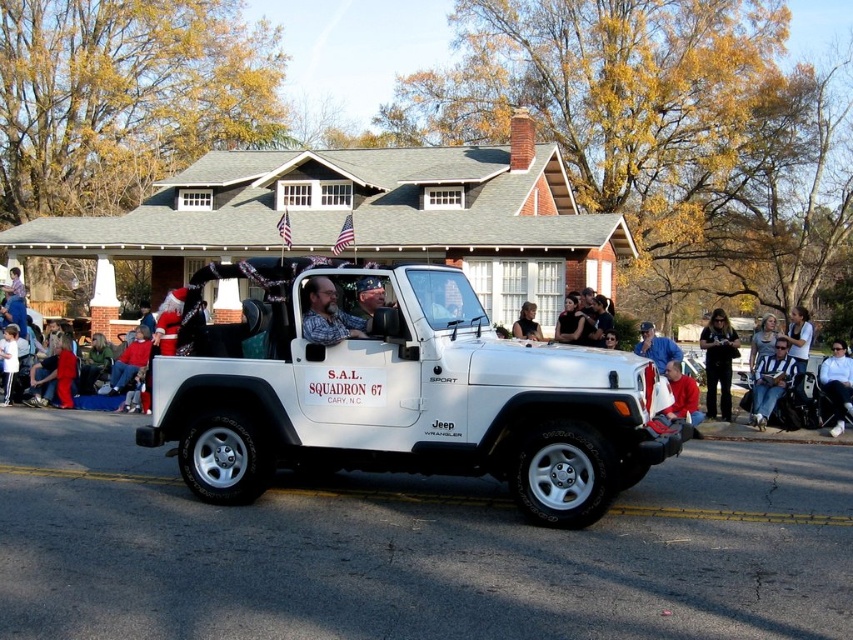
You are a photographer standing on the sidewalk during the parade. You want to take a photo that includes both the red fleece jacket at lower right and the black leather jacket at center. Which jacket will appear larger in the photo?

The red fleece jacket at lower right will appear larger in the photo because it is taller than the black leather jacket at center.

You are a photographer standing at the corner of the street where the parade is passing by. You have a matte black camera at lower right. To capture the entire Jeep Wrangler and the spectators on the sidewalk, where should you position your camera relative to the Jeep?

The matte black camera at lower right is positioned at point (718, 362), so to capture the entire Jeep Wrangler and the spectators on the sidewalk, you should position your camera slightly to the right and lower portion of the scene to ensure both the vehicle and the crowd are in frame.

You are a parade attendee standing on the sidewalk. You see the red fleece jacket at lower right and the black leather jacket at center. If you want to pass a program flyer to the driver of the Jeep Wrangler, which jacket should you target to ensure the flyer reaches the driver?

The black leather jacket at center is closer to the driver of the Jeep Wrangler since it is only 6.71 feet away from the red fleece jacket at lower right. However, the exact distance from each jacket to the driver isn